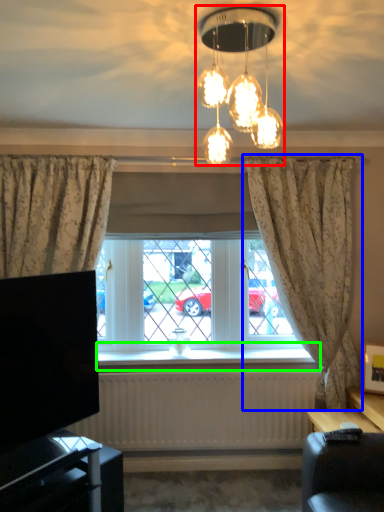
Question: Considering the real-world distances, which object is closest to lamp (highlighted by a red box)? curtain (highlighted by a blue box) or window sill (highlighted by a green box).

Choices:
 (A) curtain
 (B) window sill

Answer: (A)